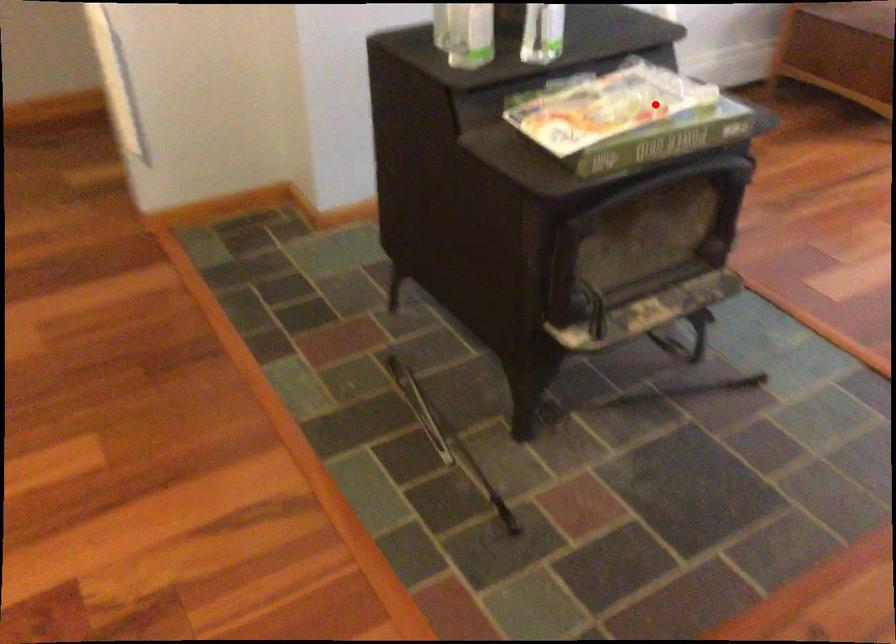
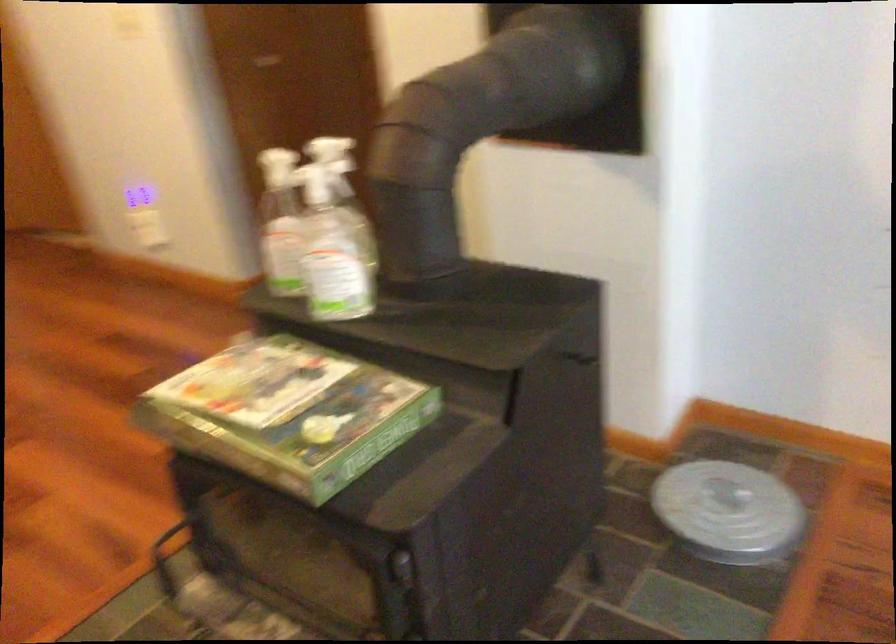
Find the pixel in the second image that matches the highlighted location in the first image.

(289, 413)